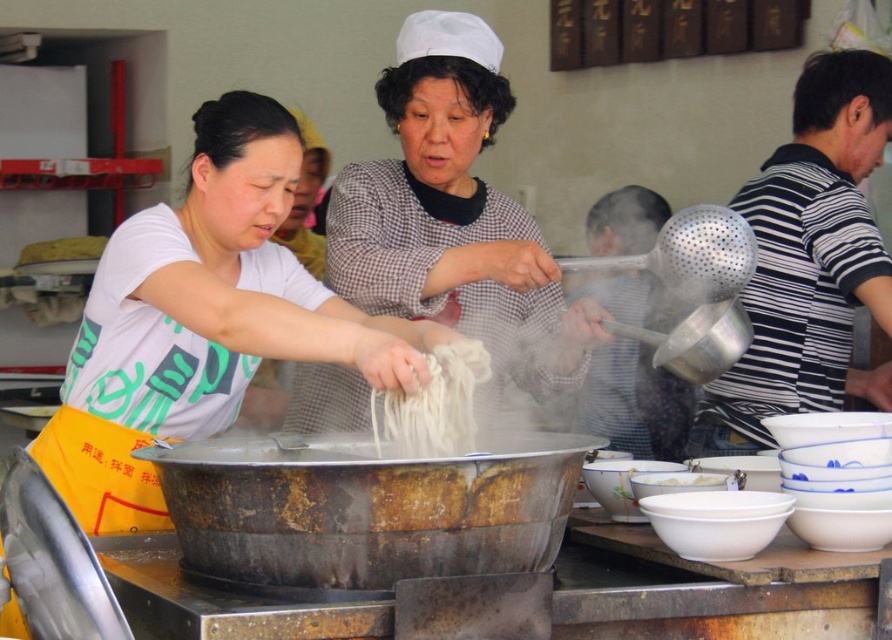
Is matte white shirt at center above white matte bowl at lower center?

Indeed, matte white shirt at center is positioned over white matte bowl at lower center.

Which is more to the left, matte white shirt at center or white matte bowl at lower center?

Positioned to the left is matte white shirt at center.

Locate an element on the screen. The height and width of the screenshot is (640, 892). matte white shirt at center is located at coordinates (204, 317).

Does rusty metal wok at center appear over white matte noodles at center?

Actually, rusty metal wok at center is below white matte noodles at center.

The height and width of the screenshot is (640, 892). What do you see at coordinates (366, 508) in the screenshot?
I see `rusty metal wok at center` at bounding box center [366, 508].

Identify the location of rusty metal wok at center. click(366, 508).

In the scene shown: Is matte white shirt at center in front of rusty metal wok at center?

No, matte white shirt at center is further to the viewer.

You are a GUI agent. You are given a task and a screenshot of the screen. Output one action in this format:
    pyautogui.click(x=<x>, y=<y>)
    Task: Click on the matte white shirt at center
    The height and width of the screenshot is (640, 892).
    Given the screenshot: What is the action you would take?
    pyautogui.click(x=204, y=317)